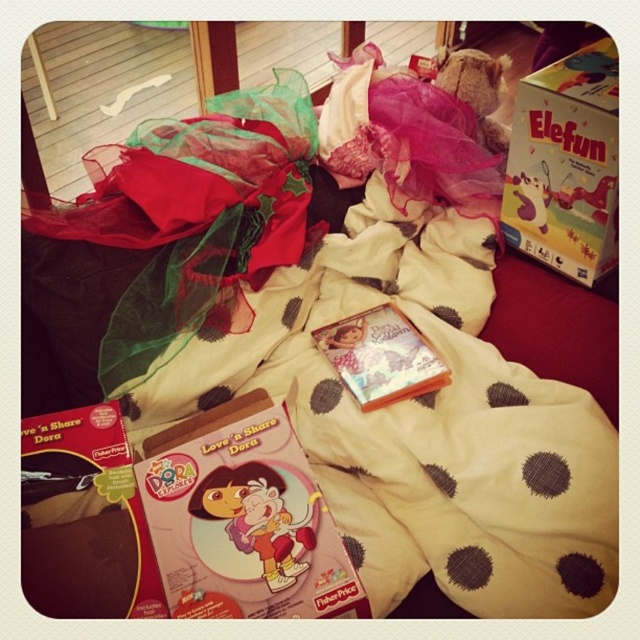
Is matte cardboard box at upper right thinner than matte cardboard box at center?

No, matte cardboard box at upper right is not thinner than matte cardboard box at center.

Does matte cardboard box at upper right have a smaller size compared to matte cardboard box at center?

No.

Is point (525, 83) positioned in front of point (289, 552)?

That is False.

What are the coordinates of `matte cardboard box at upper right` in the screenshot? It's located at (564, 164).

Which is more to the left, matte red book at center or matte cardboard box at center?

matte red book at center is more to the left.

Can you confirm if matte red book at center is smaller than matte cardboard box at center?

No, matte red book at center is not smaller than matte cardboard box at center.

This screenshot has width=640, height=640. Find the location of `matte red book at center`. matte red book at center is located at coordinates (243, 518).

Is point (259, 595) in front of point (547, 170)?

That is True.

Does matte red book at center appear over matte cardboard box at upper right?

No, matte red book at center is not above matte cardboard box at upper right.

Is point (257, 426) less distant than point (525, 220)?

Yes, it is.

Where is `matte red book at center`? matte red book at center is located at coordinates (243, 518).